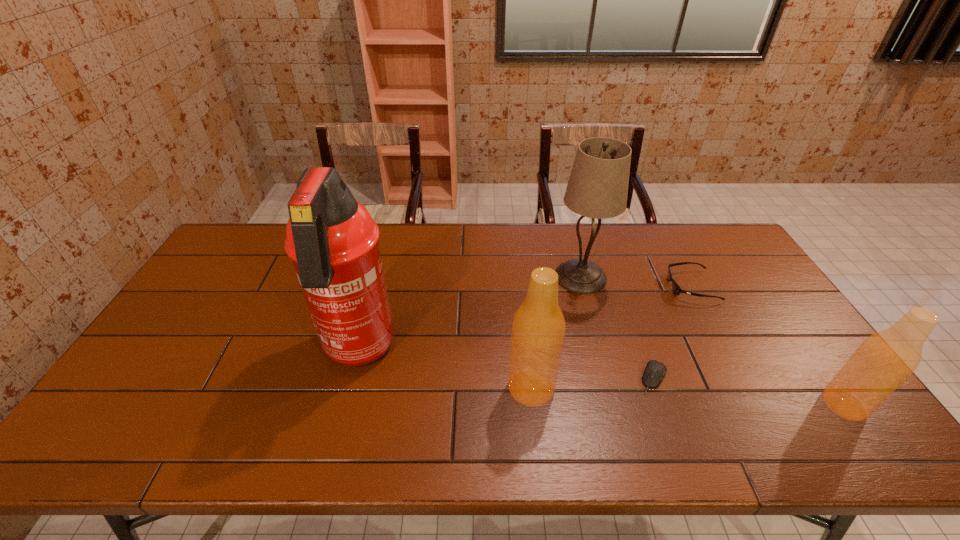
At what (x,y) coordinates should I click in order to perform the action: click on vacant space positioned on the left of the shorter beer bottle. Please return your answer as a coordinate pair (x, y). Looking at the image, I should click on (701, 404).

The height and width of the screenshot is (540, 960). In order to click on free space located on the front-facing side of the second object from right to left in this screenshot , I will do coord(549,286).

Where is `vacant area situated 0.350m on the front-facing side of the second object from right to left`? vacant area situated 0.350m on the front-facing side of the second object from right to left is located at coordinates (559, 286).

Find the location of a particular element. This screenshot has width=960, height=540. vacant space located 0.390m on the front-facing side of the second object from right to left is located at coordinates (545, 286).

I want to click on free space located on the front-facing side of the lampshade, so click(x=468, y=276).

Find the location of `vacant space located 0.070m on the front-facing side of the lampshade`. vacant space located 0.070m on the front-facing side of the lampshade is located at coordinates (532, 276).

Locate an element on the screen. free space located on the front-facing side of the lampshade is located at coordinates (489, 276).

In order to click on vacant area situated 0.060m on the trigger side of the leftmost object in this screenshot , I will do `click(342, 414)`.

The image size is (960, 540). In order to click on vacant space located on the left of the computer mouse in this screenshot , I will do `click(518, 377)`.

You are a GUI agent. You are given a task and a screenshot of the screen. Output one action in this format:
    pyautogui.click(x=<x>, y=<y>)
    Task: Click on the object at the far edge
    Image resolution: width=960 pixels, height=540 pixels.
    Given the screenshot: What is the action you would take?
    pyautogui.click(x=597, y=188)